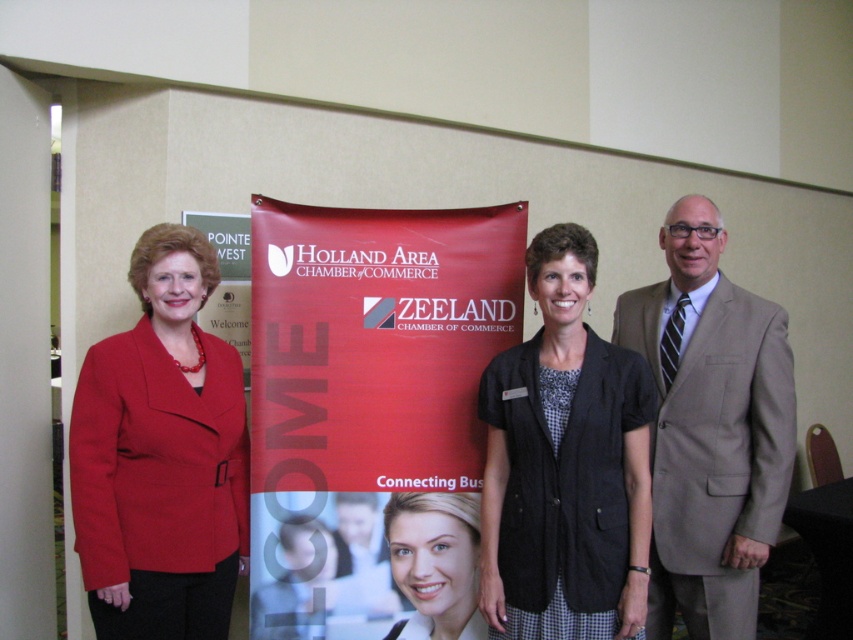
You are a photographer setting up for a group photo. You want to ensure that both the red matte banner at center and the matte red blazer at left are clearly visible in the shot. Since the banner is in front of the blazer, how should you position the subjects to avoid the blazer being obscured?

Since the matte red blazer at left is behind the red matte banner at center, you should position the person wearing the matte red blazer at left to stand in front of the red matte banner at center so that both elements are visible without obstruction.

You are standing at point (189, 509) and want to greet someone who is 1.8 meters tall. Can you reach their shoulder?

The distance between you and the viewer is 2.03 meters. Since the person is 1.8 meters tall, their shoulder is likely around 1.5 meters from the ground. To reach their shoulder, you would need to extend your arm approximately 1.5 meters. However, the average human arm length is about 0.7 meters, so you cannot reach their shoulder from 2.03 meters away.